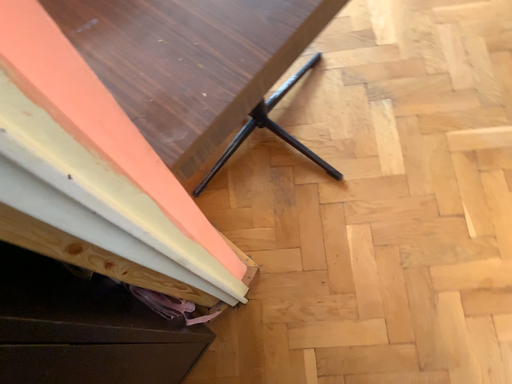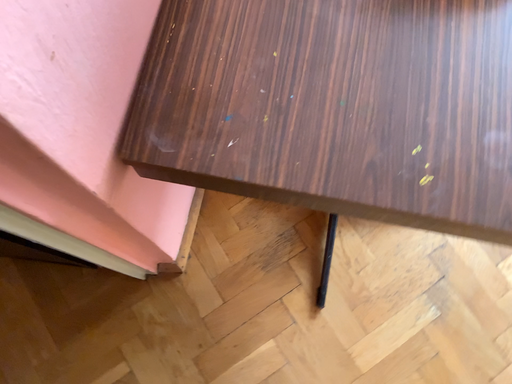
Question: How did the camera likely rotate when shooting the video?

Choices:
 (A) rotated left
 (B) rotated right

Answer: (A)